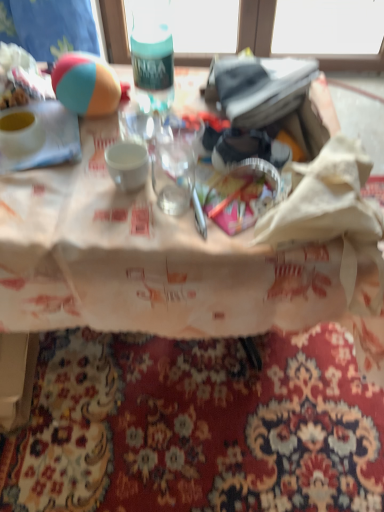
At what (x,y) coordinates should I click in order to perform the action: click on free space to the back side of translucent plastic cup at center. Please return your answer as a coordinate pair (x, y). This screenshot has width=384, height=512. Looking at the image, I should click on (194, 145).